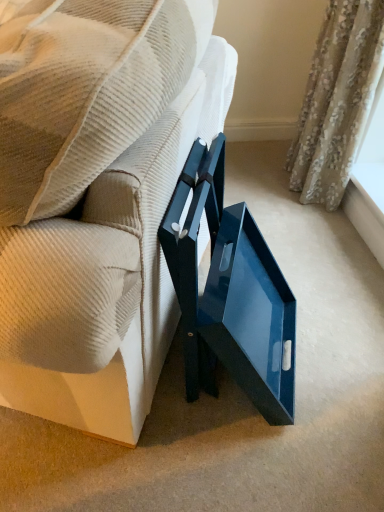
Question: Considering the relative sizes of glossy blue tray at center and white textured window sill at upper right in the image provided, is glossy blue tray at center taller than white textured window sill at upper right?

Choices:
 (A) no
 (B) yes

Answer: (B)

Question: From the image's perspective, does glossy blue tray at center appear lower than white textured window sill at upper right?

Choices:
 (A) no
 (B) yes

Answer: (A)

Question: From a real-world perspective, is glossy blue tray at center beneath white textured window sill at upper right?

Choices:
 (A) no
 (B) yes

Answer: (A)

Question: Can you confirm if glossy blue tray at center is bigger than white textured window sill at upper right?

Choices:
 (A) yes
 (B) no

Answer: (A)

Question: Does glossy blue tray at center turn towards white textured window sill at upper right?

Choices:
 (A) yes
 (B) no

Answer: (B)

Question: Does glossy blue tray at center have a lesser width compared to white textured window sill at upper right?

Choices:
 (A) yes
 (B) no

Answer: (B)

Question: Does floral fabric curtain at upper right appear on the left side of glossy blue tray at center?

Choices:
 (A) no
 (B) yes

Answer: (A)

Question: Is glossy blue tray at center a part of floral fabric curtain at upper right?

Choices:
 (A) no
 (B) yes

Answer: (A)

Question: From a real-world perspective, is floral fabric curtain at upper right located higher than glossy blue tray at center?

Choices:
 (A) yes
 (B) no

Answer: (B)

Question: From the image's perspective, is floral fabric curtain at upper right on glossy blue tray at center?

Choices:
 (A) yes
 (B) no

Answer: (A)

Question: Does floral fabric curtain at upper right have a greater height compared to glossy blue tray at center?

Choices:
 (A) no
 (B) yes

Answer: (A)

Question: Does floral fabric curtain at upper right come in front of glossy blue tray at center?

Choices:
 (A) yes
 (B) no

Answer: (B)

Question: Is white textured window sill at upper right positioned with its back to floral fabric curtain at upper right?

Choices:
 (A) yes
 (B) no

Answer: (B)